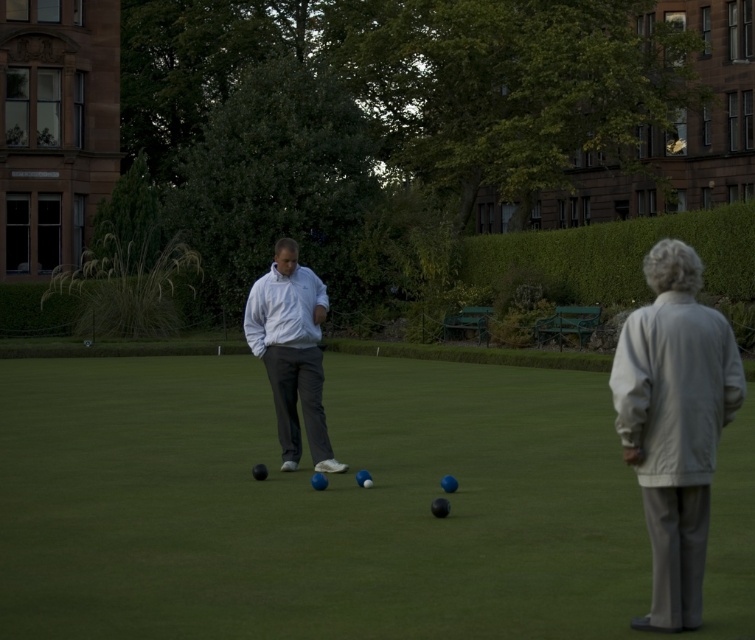
Does light gray fabric jacket at right appear on the left side of white matte jacket at center?

Incorrect, light gray fabric jacket at right is not on the left side of white matte jacket at center.

Does light gray fabric jacket at right have a lesser width compared to white matte jacket at center?

No, light gray fabric jacket at right is not thinner than white matte jacket at center.

Does point (669, 300) come behind point (302, 292)?

No, it is not.

This screenshot has height=640, width=755. I want to click on light gray fabric jacket at right, so click(x=673, y=422).

Between green grass at center and white matte jacket at center, which one appears on the right side from the viewer's perspective?

green grass at center

Describe the element at coordinates (313, 502) in the screenshot. Image resolution: width=755 pixels, height=640 pixels. I see `green grass at center` at that location.

You are a GUI agent. You are given a task and a screenshot of the screen. Output one action in this format:
    pyautogui.click(x=<x>, y=<y>)
    Task: Click on the green grass at center
    
    Given the screenshot: What is the action you would take?
    pyautogui.click(x=313, y=502)

Based on the photo, can you confirm if green grass at center is shorter than light gray fabric jacket at right?

Indeed, green grass at center has a lesser height compared to light gray fabric jacket at right.

Locate an element on the screen. The width and height of the screenshot is (755, 640). green grass at center is located at coordinates (313, 502).